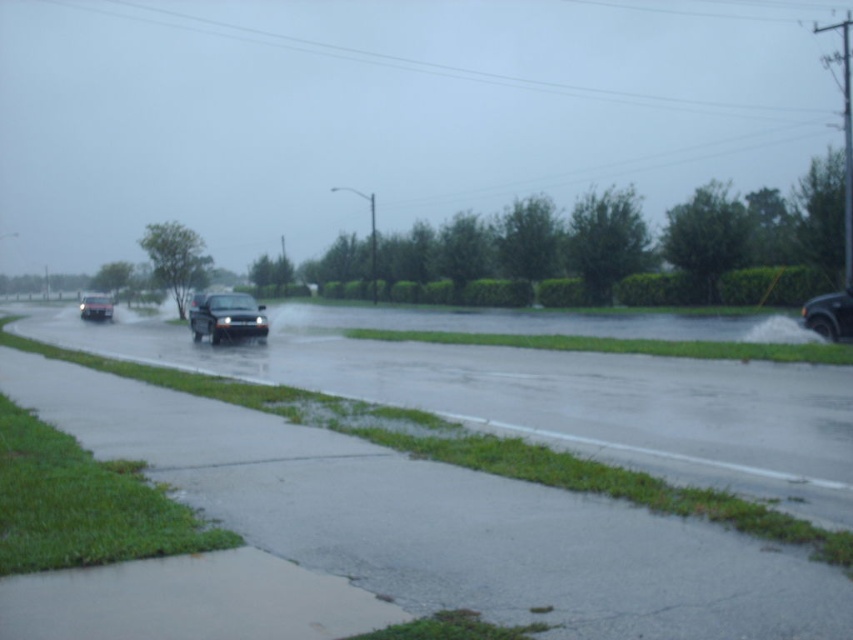
Question: Is metallic silver suv at lower right below matte black truck at center?

Choices:
 (A) no
 (B) yes

Answer: (B)

Question: Estimate the real-world distances between objects in this image. Which object is closer to the matte black truck at center?

Choices:
 (A) smokey gray metallic car at center
 (B) metallic silver suv at lower right

Answer: (A)

Question: Estimate the real-world distances between objects in this image. Which object is closer to the metallic silver suv at lower right?

Choices:
 (A) matte black truck at center
 (B) smokey gray metallic car at center

Answer: (B)

Question: Which of the following is the farthest from the observer?

Choices:
 (A) (824, 292)
 (B) (221, 294)
 (C) (97, 312)

Answer: (C)

Question: Can you confirm if smokey gray metallic car at center is smaller than matte black truck at center?

Choices:
 (A) no
 (B) yes

Answer: (B)

Question: Does smokey gray metallic car at center appear under metallic silver suv at lower right?

Choices:
 (A) no
 (B) yes

Answer: (A)